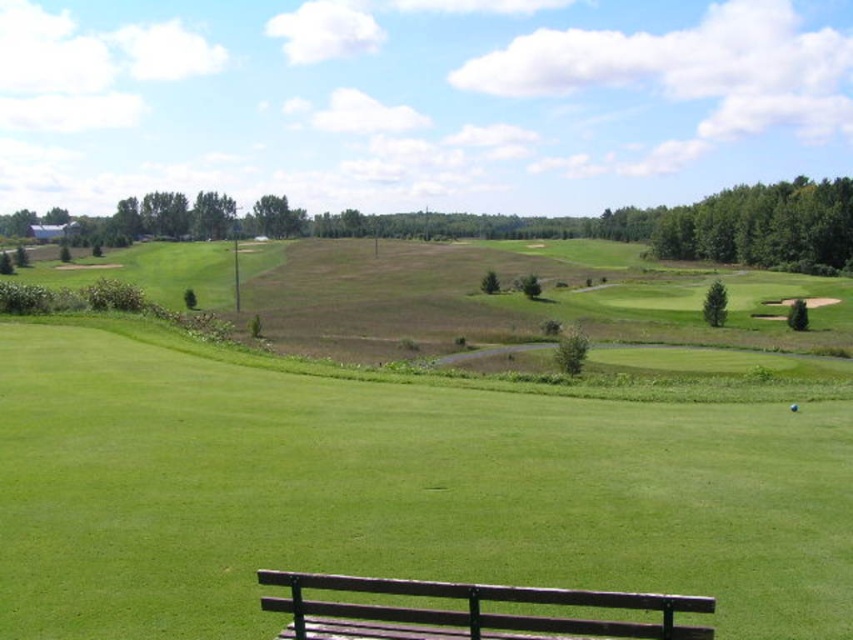
You are a golfer standing on the green grassy field at center and want to reach the brown wooden bench at lower center. Which direction should you move to get closer to the bench?

The brown wooden bench at lower center is closer to you than the green grassy field at center, so you should move backward to get closer to the bench.

You are a golfer standing on the green grassy field at center and want to place your golf ball on the brown wooden bench at lower center. Can the golf ball stay on the bench without rolling off?

The green grassy field at center is much taller than the brown wooden bench at lower center, so the bench is lower in elevation. Since the bench is lower, the golf ball placed on it might roll off if the bench is not level. However, the description does not mention the bench slope, so we can only confirm the height difference. The bench being lower than the grassy field does not necessarily mean the ball will roll off unless the bench is sloped.

You are a golfer standing on the brown wooden bench at lower center. You want to hit a ball towards the green grassy field at center. Which direction should you aim?

You should aim to the right since the green grassy field at center is located to the right of the brown wooden bench at lower center.